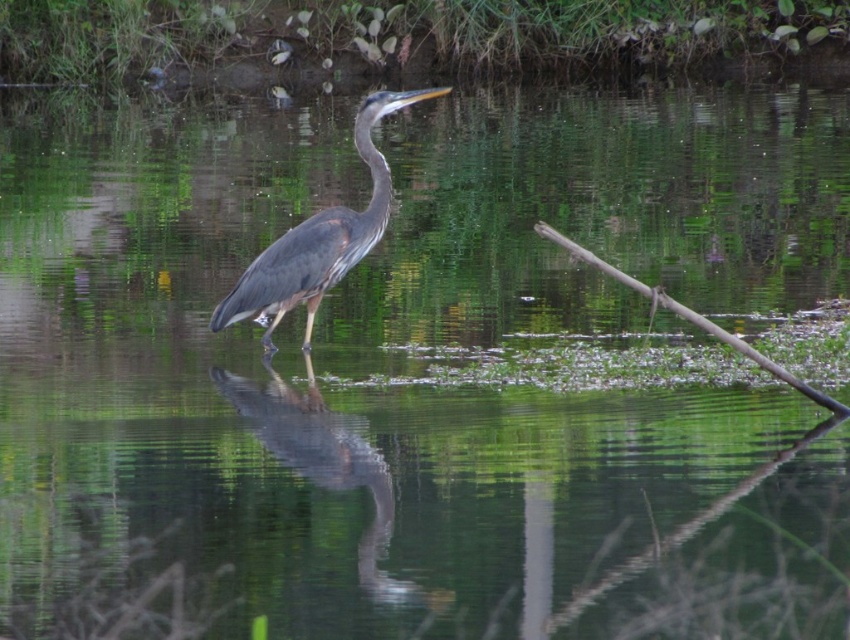
Is shiny blue heron at center shorter than gray matte heron at center?

No.

Between point (371, 577) and point (377, 173), which one is positioned in front?

Point (371, 577) is in front.

What do you see at coordinates (327, 467) in the screenshot? I see `shiny blue heron at center` at bounding box center [327, 467].

The width and height of the screenshot is (850, 640). In order to click on shiny blue heron at center in this screenshot , I will do (x=327, y=467).

In the scene shown: Is gray matte heron at center bigger than brown wood branch at right?

Actually, gray matte heron at center might be smaller than brown wood branch at right.

Does gray matte heron at center have a lesser height compared to brown wood branch at right?

Indeed, gray matte heron at center has a lesser height compared to brown wood branch at right.

Is point (255, 289) more distant than point (591, 259)?

Yes, point (255, 289) is farther from viewer.

In order to click on gray matte heron at center in this screenshot , I will do `click(319, 237)`.

Is shiny blue heron at center smaller than brown wood branch at right?

No.

Is point (343, 483) positioned in front of point (652, 301)?

Yes, point (343, 483) is closer to viewer.

Find the location of `shiny blue heron at center`. shiny blue heron at center is located at coordinates (327, 467).